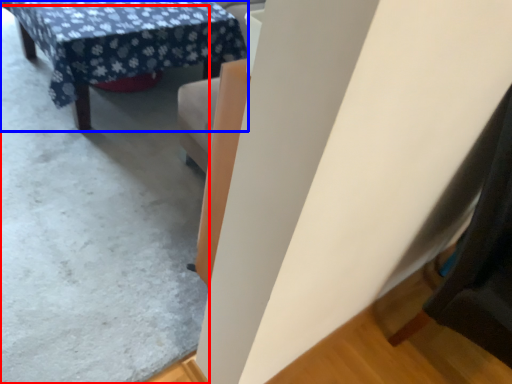
Question: Which object is further to the camera taking this photo, concrete (highlighted by a red box) or table (highlighted by a blue box)?

Choices:
 (A) concrete
 (B) table

Answer: (B)